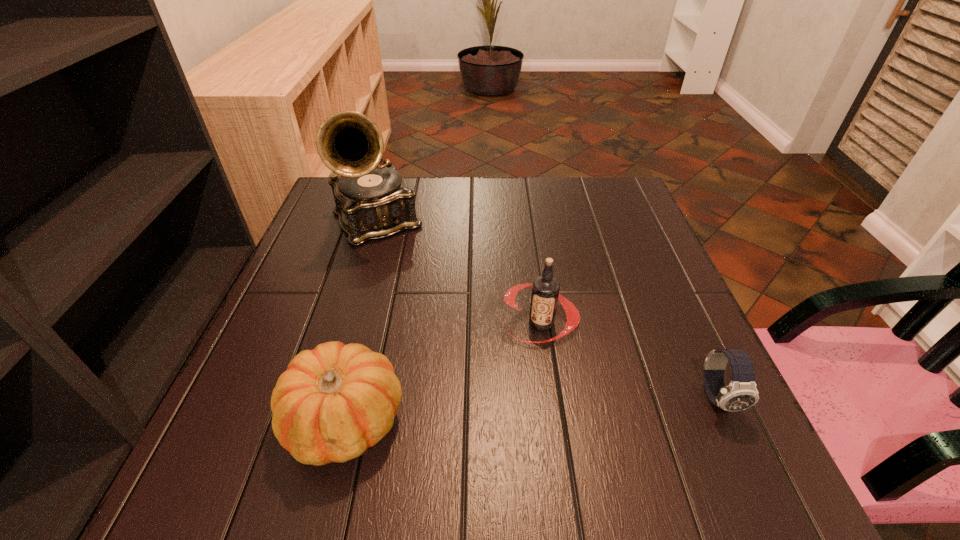
Where is `vacant space on the desktop that is between the gourd and the rightmost object and is positioned on the label of the second tallest object`? The width and height of the screenshot is (960, 540). vacant space on the desktop that is between the gourd and the rightmost object and is positioned on the label of the second tallest object is located at coordinates (489, 411).

Locate an element on the screen. The width and height of the screenshot is (960, 540). vacant spot on the desktop that is between the gourd and the watch and is positioned on the horn of the phonograph record is located at coordinates (492, 411).